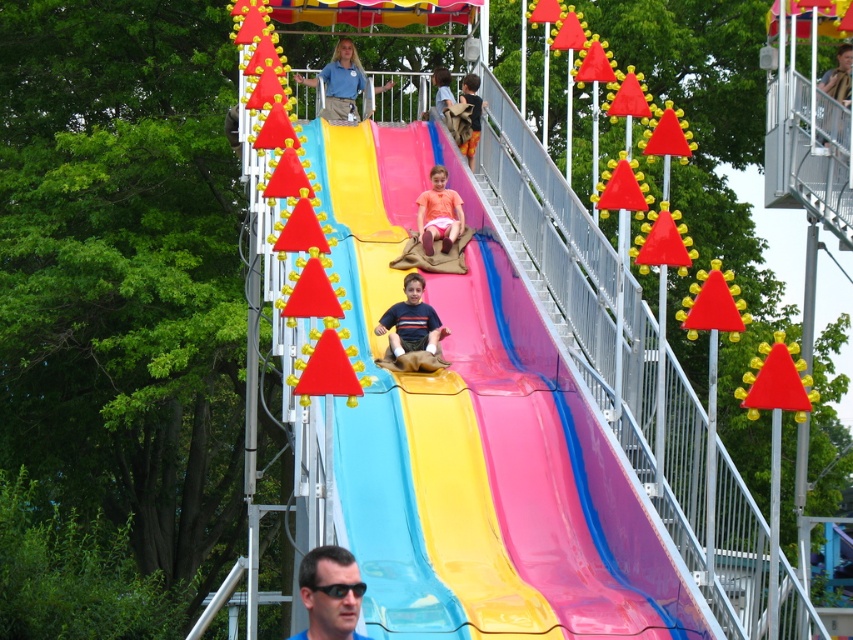
Question: Is matte black sunglasses at lower center further to camera compared to tan fabric bag at center?

Choices:
 (A) no
 (B) yes

Answer: (A)

Question: Considering the relative positions of matte blue shirt at center and matte pink shorts at center in the image provided, where is matte blue shirt at center located with respect to matte pink shorts at center?

Choices:
 (A) below
 (B) above

Answer: (A)

Question: Which object appears farthest from the camera in this image?

Choices:
 (A) matte black sunglasses at lower center
 (B) matte blue shirt at center

Answer: (B)

Question: Which of these objects is positioned farthest from the matte black sunglasses at lower center?

Choices:
 (A) shiny plastic slide at center
 (B) tan fabric bag at center
 (C) matte pink shorts at center

Answer: (B)

Question: Is matte black sunglasses at lower center to the left of matte pink shorts at center from the viewer's perspective?

Choices:
 (A) yes
 (B) no

Answer: (A)

Question: Which of the following is the farthest from the observer?

Choices:
 (A) (335, 611)
 (B) (454, 220)
 (C) (331, 100)
 (D) (426, 339)

Answer: (C)